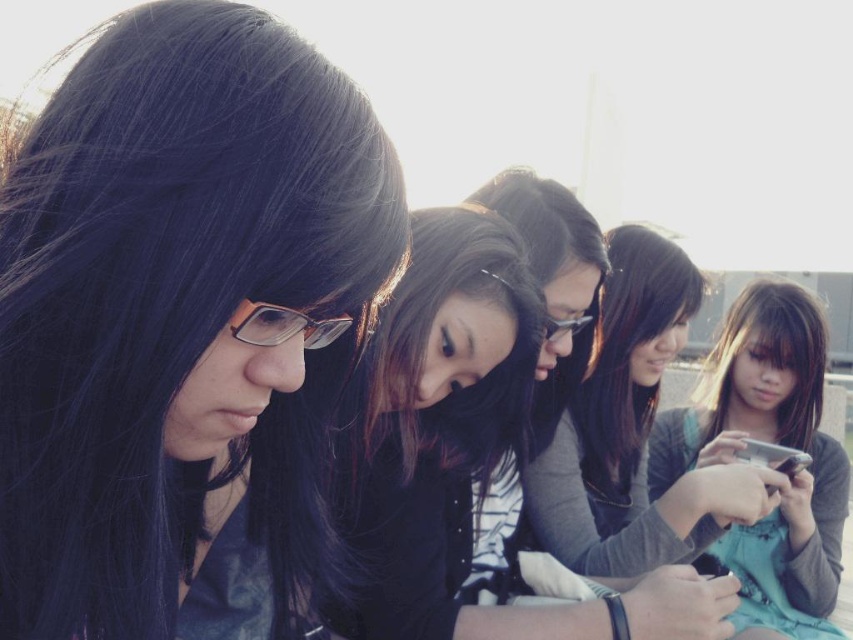
Between smooth black hair at center and teal fabric dress at center, which one appears on the right side from the viewer's perspective?

teal fabric dress at center is more to the right.

Does point (456, 312) lie behind point (730, 456)?

No.

Which is in front, point (352, 497) or point (792, 524)?

Positioned in front is point (352, 497).

Where is `smooth black hair at center`? The width and height of the screenshot is (853, 640). smooth black hair at center is located at coordinates (438, 436).

Does smooth black hair at center appear on the right side of dark brown silky hair at lower right?

No, smooth black hair at center is not to the right of dark brown silky hair at lower right.

From the picture: Who is shorter, smooth black hair at center or dark brown silky hair at lower right?

Standing shorter between the two is dark brown silky hair at lower right.

Between point (572, 620) and point (750, 300), which one is positioned behind?

Point (750, 300)

The width and height of the screenshot is (853, 640). I want to click on smooth black hair at center, so click(x=438, y=436).

Is dark matte hair at center thinner than teal fabric dress at center?

Yes, dark matte hair at center is thinner than teal fabric dress at center.

Does dark matte hair at center appear over teal fabric dress at center?

Indeed, dark matte hair at center is positioned over teal fabric dress at center.

Does point (33, 472) lie in front of point (764, 561)?

Yes, point (33, 472) is closer to viewer.

Locate an element on the screen. This screenshot has width=853, height=640. dark matte hair at center is located at coordinates (184, 326).